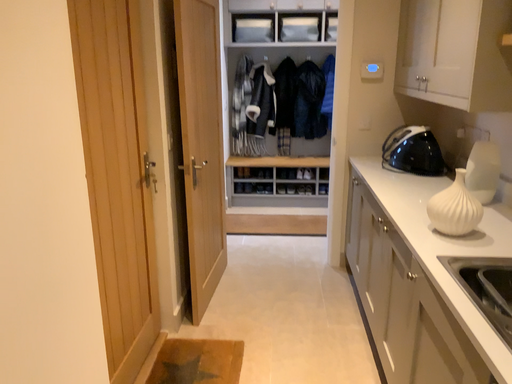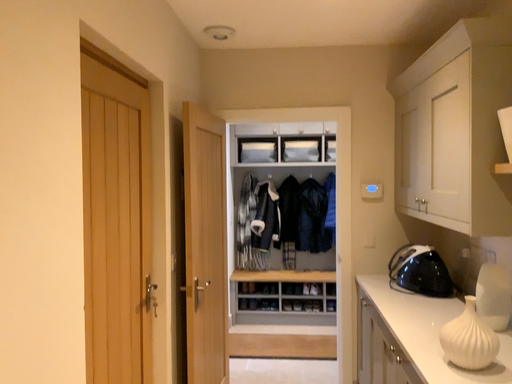
Question: How did the camera likely rotate when shooting the video?

Choices:
 (A) rotated upward
 (B) rotated downward

Answer: (A)